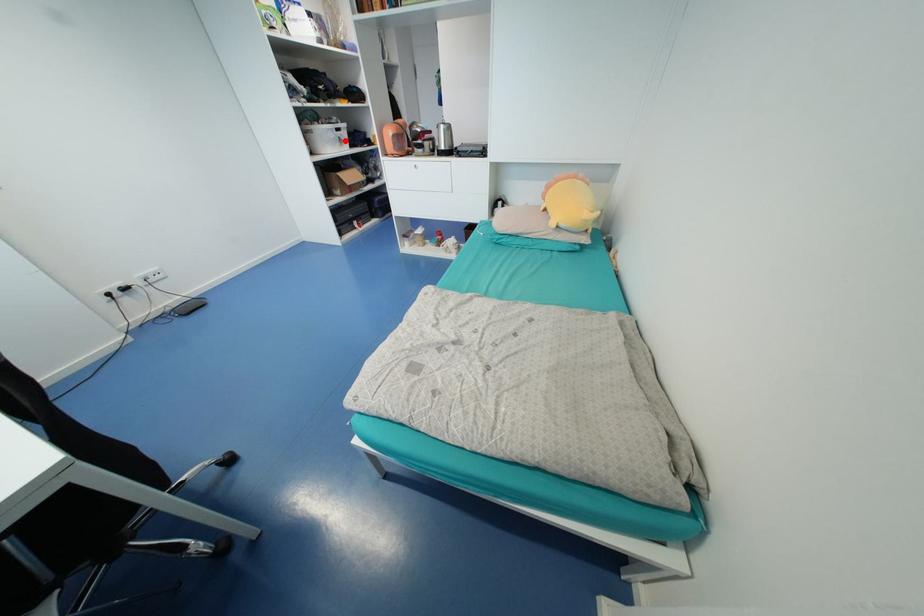
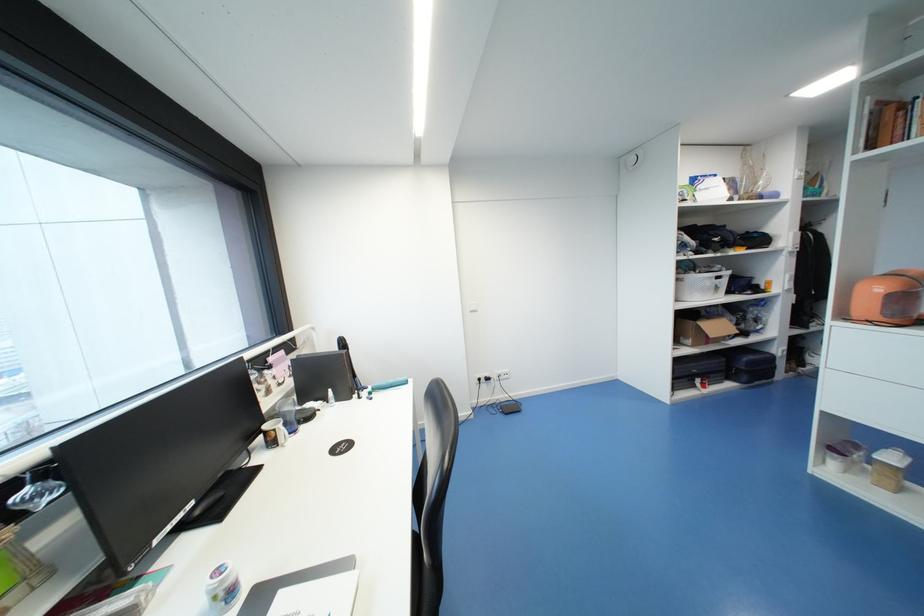
In the second image, find the point that corresponds to the highlighted location in the first image.

(721, 288)